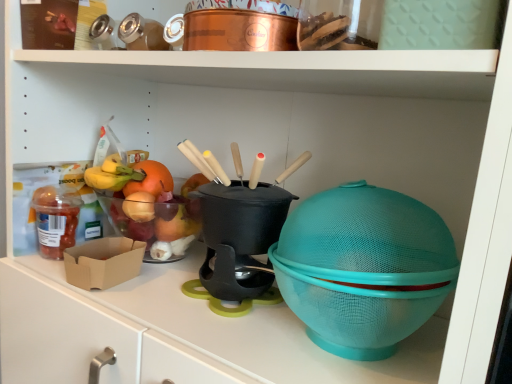
Question: Would you say translucent plastic container at left is a long distance from black plastic pot at center?

Choices:
 (A) no
 (B) yes

Answer: (A)

Question: Could you tell me if translucent plastic container at left is facing black plastic pot at center?

Choices:
 (A) no
 (B) yes

Answer: (A)

Question: Is translucent plastic container at left with black plastic pot at center?

Choices:
 (A) no
 (B) yes

Answer: (A)

Question: From the image's perspective, would you say translucent plastic container at left is shown under black plastic pot at center?

Choices:
 (A) yes
 (B) no

Answer: (A)

Question: Does translucent plastic container at left appear on the left side of black plastic pot at center?

Choices:
 (A) yes
 (B) no

Answer: (A)

Question: Does translucent plastic container at left have a lesser width compared to black plastic pot at center?

Choices:
 (A) no
 (B) yes

Answer: (B)

Question: Is black plastic pot at center closer to the viewer compared to translucent plastic container at left?

Choices:
 (A) yes
 (B) no

Answer: (A)

Question: Is black plastic pot at center wider than translucent plastic container at left?

Choices:
 (A) no
 (B) yes

Answer: (B)

Question: Does black plastic pot at center have a greater height compared to translucent plastic container at left?

Choices:
 (A) yes
 (B) no

Answer: (A)

Question: Is black plastic pot at center shorter than translucent plastic container at left?

Choices:
 (A) no
 (B) yes

Answer: (A)

Question: From a real-world perspective, is black plastic pot at center positioned under translucent plastic container at left based on gravity?

Choices:
 (A) no
 (B) yes

Answer: (A)

Question: Are black plastic pot at center and translucent plastic container at left far apart?

Choices:
 (A) no
 (B) yes

Answer: (A)

Question: In terms of size, does black plastic pot at center appear bigger or smaller than translucent plastic container at left?

Choices:
 (A) big
 (B) small

Answer: (A)